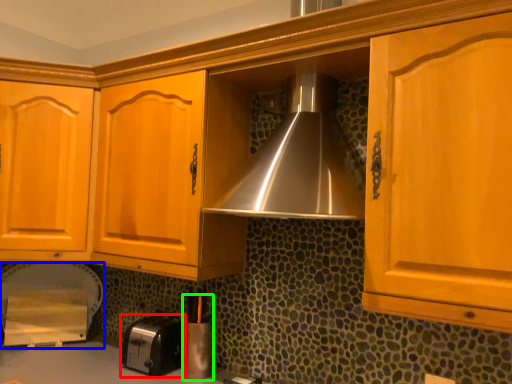
Question: Based on their relative distances, which object is farther from toaster (highlighted by a red box)? Choose from appliance (highlighted by a blue box) and appliance (highlighted by a green box).

Choices:
 (A) appliance
 (B) appliance

Answer: (A)